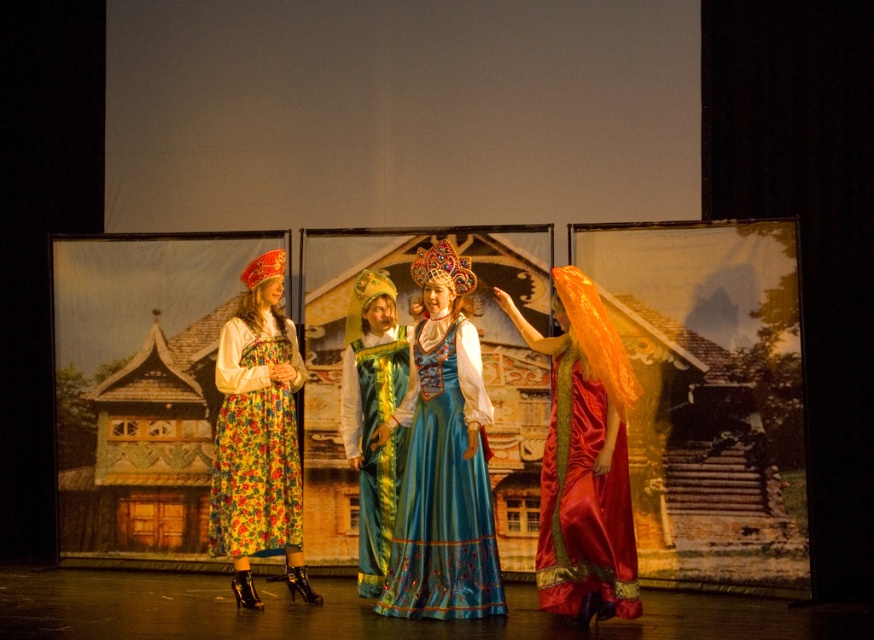
Question: Can you confirm if blue satin dress at center is thinner than floral fabric dress at left?

Choices:
 (A) yes
 (B) no

Answer: (B)

Question: Among these points, which one is farthest from the camera?

Choices:
 (A) (276, 387)
 (B) (432, 442)

Answer: (A)

Question: From the image, what is the correct spatial relationship of blue satin dress at center in relation to shiny red silk dress at right?

Choices:
 (A) right
 (B) left

Answer: (B)

Question: Among these objects, which one is nearest to the camera?

Choices:
 (A) floral fabric dress at left
 (B) blue satin dress at center
 (C) shiny red silk dress at right
 (D) velvet teal dress at center

Answer: (C)

Question: Based on their relative distances, which object is farther from the floral fabric dress at left?

Choices:
 (A) shiny red silk dress at right
 (B) velvet teal dress at center
 (C) blue satin dress at center

Answer: (A)

Question: Is blue satin dress at center to the left of floral fabric dress at left from the viewer's perspective?

Choices:
 (A) no
 (B) yes

Answer: (A)